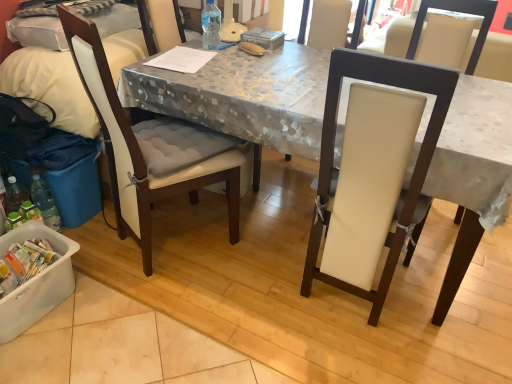
The image size is (512, 384). I want to click on vacant space in front of white padded chair at left, the first chair from the left, so click(x=157, y=322).